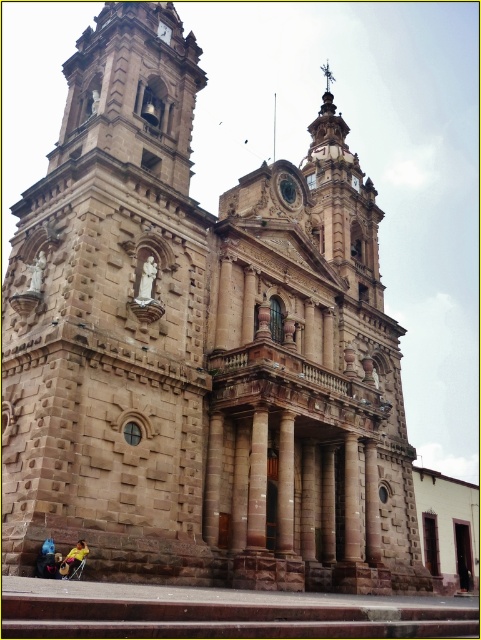
Question: Is brown stone column at center below matte brown clock at upper center?

Choices:
 (A) yes
 (B) no

Answer: (A)

Question: Can you confirm if brown stone column at center is bigger than matte brown clock at upper center?

Choices:
 (A) yes
 (B) no

Answer: (A)

Question: Is brown stone column at center smaller than matte brown clock at upper center?

Choices:
 (A) yes
 (B) no

Answer: (B)

Question: Which object is closer to the camera taking this photo?

Choices:
 (A) matte brown clock at upper center
 (B) brown stone column at center

Answer: (B)

Question: Which of the following is the farthest from the observer?

Choices:
 (A) (156, 29)
 (B) (255, 550)

Answer: (A)